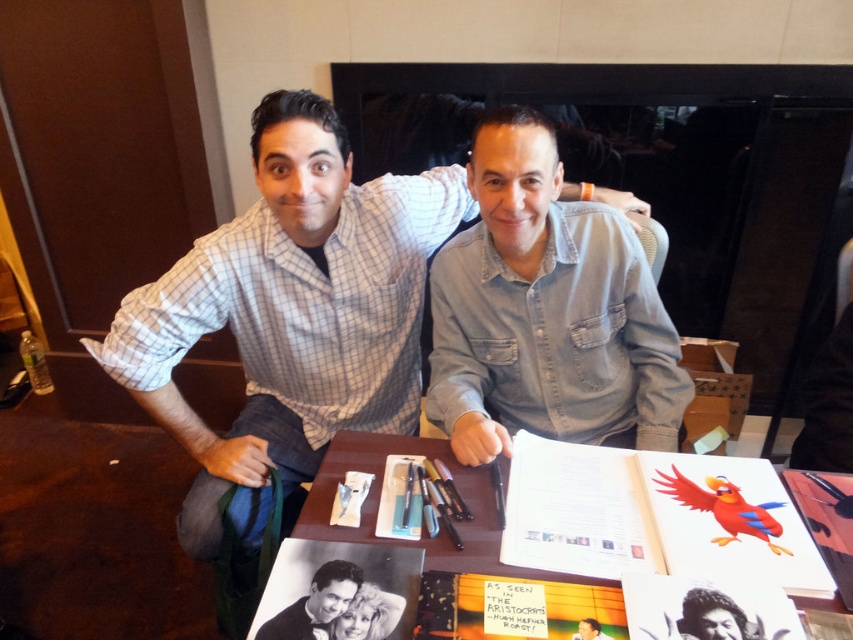
Question: Is white checkered shirt at upper left smaller than wooden table at center?

Choices:
 (A) yes
 (B) no

Answer: (B)

Question: Does denim shirt at center appear over wooden table at center?

Choices:
 (A) no
 (B) yes

Answer: (B)

Question: Among these objects, which one is nearest to the camera?

Choices:
 (A) denim shirt at center
 (B) wooden table at center
 (C) white checkered shirt at upper left

Answer: (B)

Question: Considering the real-world distances, which object is farthest from the white checkered shirt at upper left?

Choices:
 (A) denim shirt at center
 (B) matte black bow tie at center

Answer: (B)

Question: Is white checkered shirt at upper left above matte black bow tie at center?

Choices:
 (A) yes
 (B) no

Answer: (A)

Question: Which of these objects is positioned farthest from the denim shirt at center?

Choices:
 (A) wooden table at center
 (B) white checkered shirt at upper left

Answer: (B)